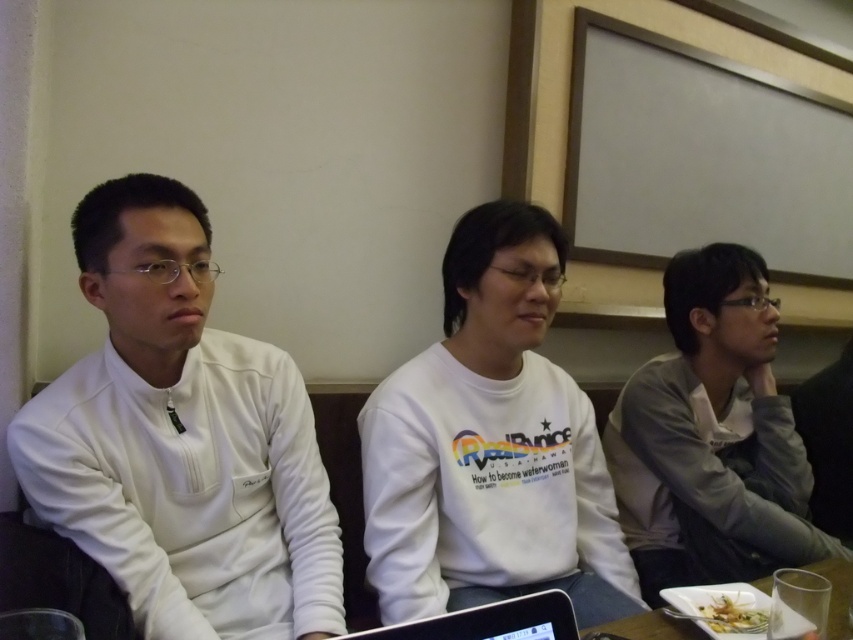
Between white matte sweatshirt at left and white matte sweatshirt at center, which one appears on the right side from the viewer's perspective?

white matte sweatshirt at center

How much distance is there between white matte sweatshirt at left and white matte sweatshirt at center?

A distance of 13.38 inches exists between white matte sweatshirt at left and white matte sweatshirt at center.

Image resolution: width=853 pixels, height=640 pixels. Describe the element at coordinates (181, 438) in the screenshot. I see `white matte sweatshirt at left` at that location.

Identify the location of white matte sweatshirt at left. The image size is (853, 640). pos(181,438).

Which is behind, point (479, 611) or point (630, 621)?

The point (630, 621) is behind.

Describe the element at coordinates (490, 621) in the screenshot. I see `black glossy laptop at center` at that location.

At what (x,y) coordinates should I click in order to perform the action: click on black glossy laptop at center. Please return your answer as a coordinate pair (x, y). The height and width of the screenshot is (640, 853). Looking at the image, I should click on [490, 621].

Which is below, white matte sweatshirt at left or white plastic plate at lower right?

white plastic plate at lower right

Who is taller, white matte sweatshirt at left or white plastic plate at lower right?

white matte sweatshirt at left is taller.

The height and width of the screenshot is (640, 853). I want to click on white matte sweatshirt at left, so click(x=181, y=438).

Where is `white matte sweatshirt at left`? The height and width of the screenshot is (640, 853). white matte sweatshirt at left is located at coordinates (181, 438).